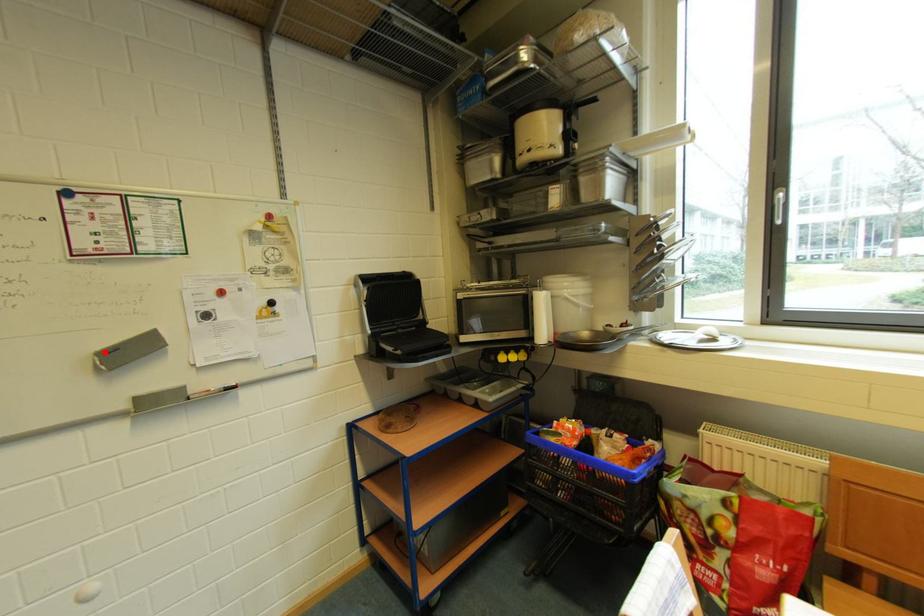
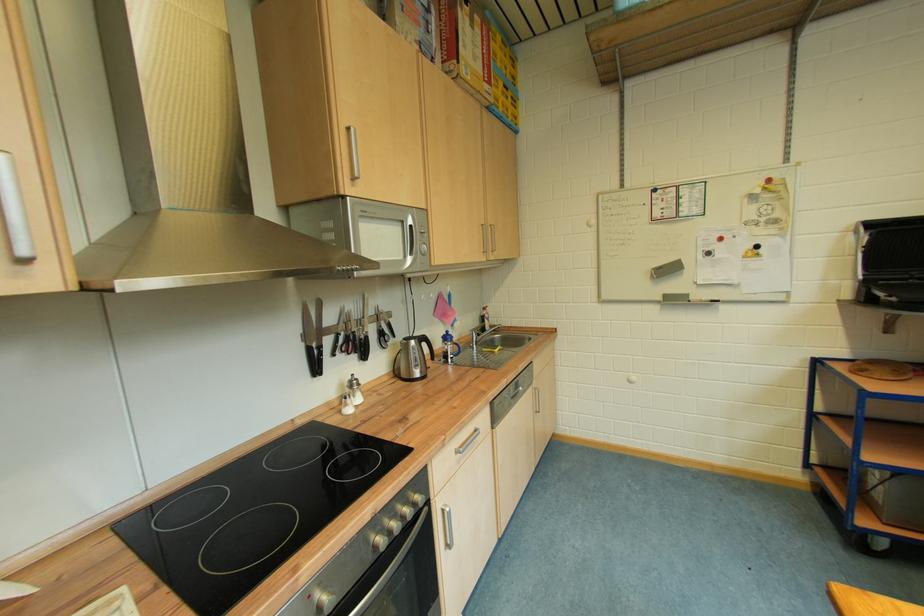
Where in the second image is the point corresponding to the highlighted location from the first image?

(661, 270)